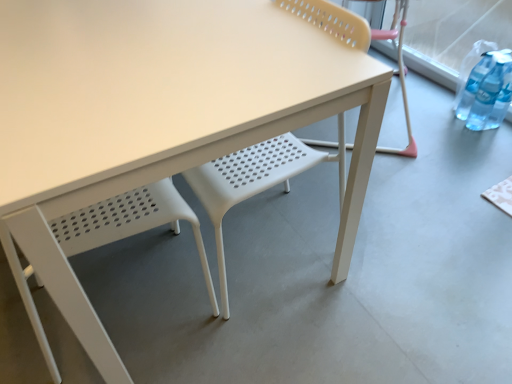
Locate an element on the screen. The height and width of the screenshot is (384, 512). vacant area that is situated to the right of white plastic chair at lower left, which ranks as the 2th chair in back-to-front order is located at coordinates (259, 340).